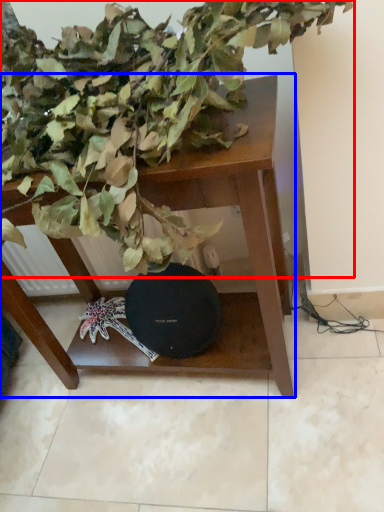
Question: Which of the following is the farthest to the observer, houseplant (highlighted by a red box) or table (highlighted by a blue box)?

Choices:
 (A) houseplant
 (B) table

Answer: (B)